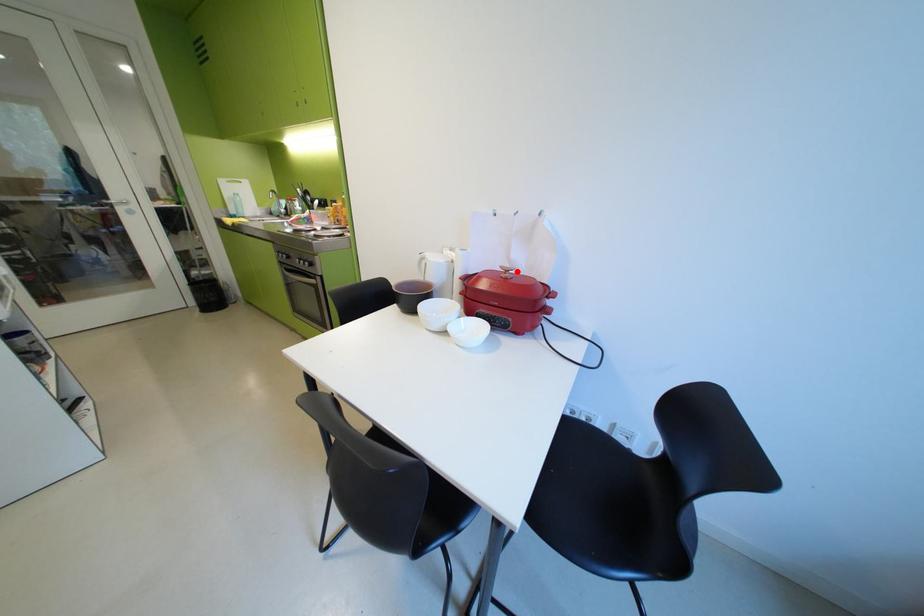
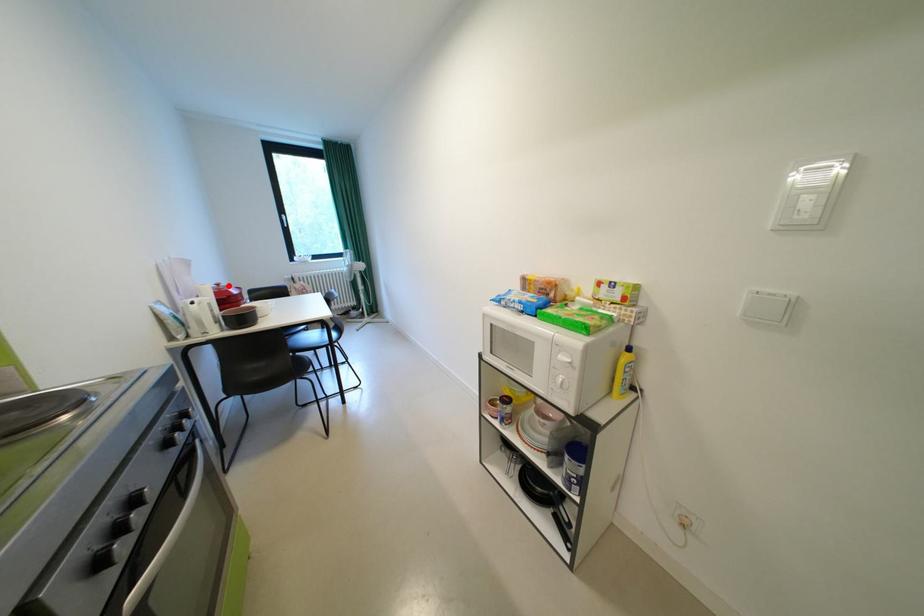
From the picture: I am providing you with two images of the same scene from different viewpoints. A red point is marked on the first image and another point is marked on the second image. Is the marked point in image1 the same physical position as the marked point in image2?

Yes